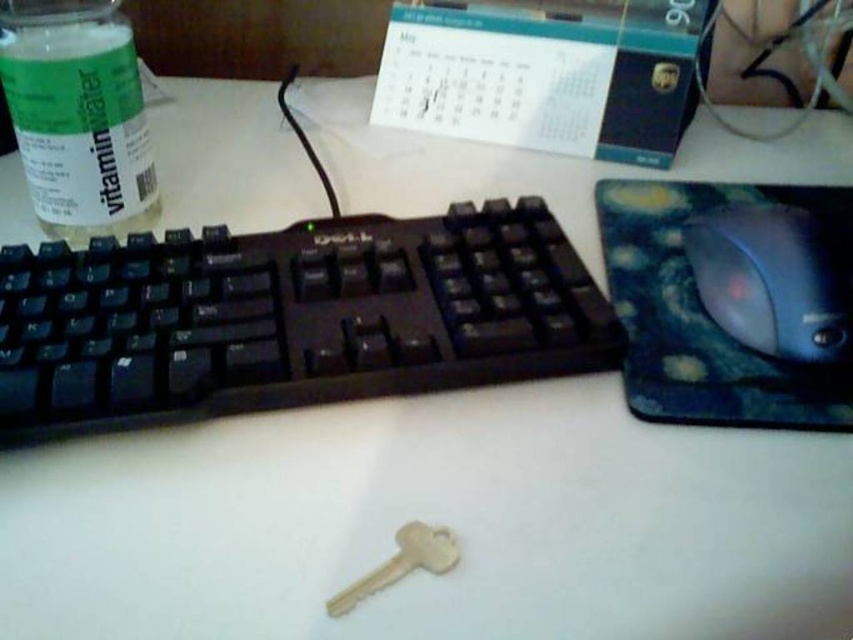
Consider the image. You are organizing your desk and want to place a new wireless charger between the black plastic keyboard at center and the blue plastic mouse at right. Considering their sizes, which object should the charger be placed closer to to ensure it doesn

The black plastic keyboard at center is larger than the blue plastic mouse at right, so the wireless charger should be placed closer to the blue plastic mouse at right to accommodate the keyboard

You are organizing items on your desk and want to place the white paper calendar at upper center and the gold metallic key at center into a drawer. The drawer has a height limit of 10 cm. Can both items fit vertically in the drawer without bending or folding them?

The white paper calendar at upper center is taller than the gold metallic key at center. Since the calendar is taller and the drawer has a height limit of 10 cm, if the calendar exceeds this height, it won